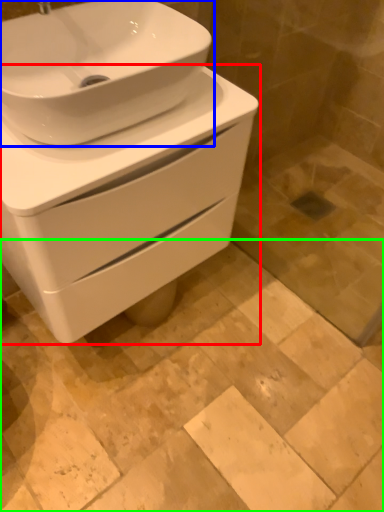
Question: Considering the real-world distances, which object is closest to toilet (highlighted by a red box)? sink (highlighted by a blue box) or ceramic tile (highlighted by a green box).

Choices:
 (A) sink
 (B) ceramic tile

Answer: (A)